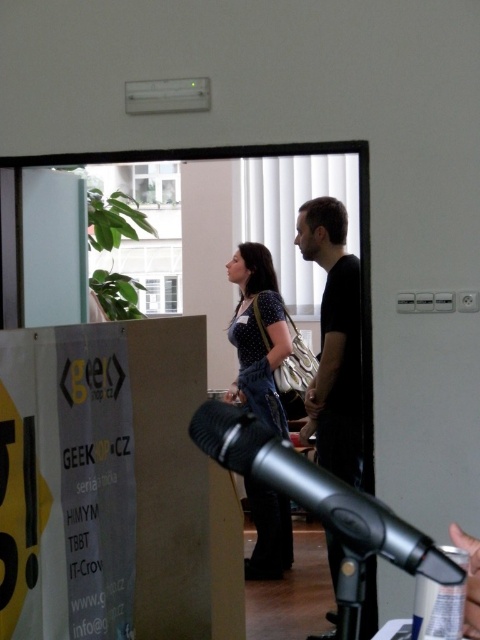
You are at an event and need to locate two people standing near the doorway. The black matte shirt at center and the polka dot blouse at center are both visible. Which one is positioned to the right of the other?

The black matte shirt at center is to the right of the polka dot blouse at center.

You are an event organizer who needs to adjust the microphone height so that both the woman and the man can speak comfortably. Given that the silver metallic microphone at center is shorter than the black matte shirt at center, which is worn by the man, what should you do?

The silver metallic microphone at center is shorter than the black matte shirt at center, so you should raise the microphone stand to ensure it reaches a comfortable speaking height for the man wearing the black matte shirt at center.